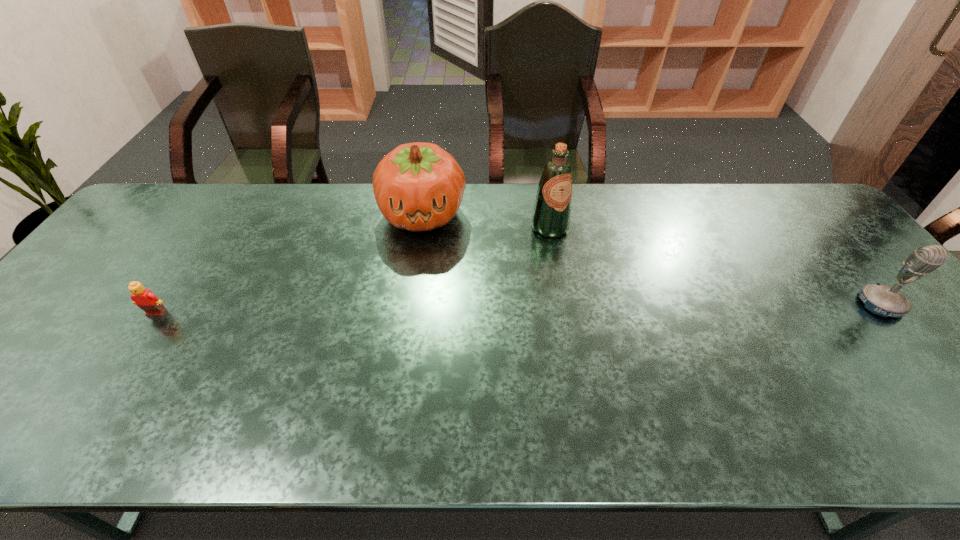
Find the location of a particular element. The height and width of the screenshot is (540, 960). Lego is located at coordinates (143, 298).

You are a GUI agent. You are given a task and a screenshot of the screen. Output one action in this format:
    pyautogui.click(x=<x>, y=<y>)
    Task: Click on the shortest object
    The height and width of the screenshot is (540, 960).
    Given the screenshot: What is the action you would take?
    pyautogui.click(x=143, y=298)

At what (x,y) coordinates should I click in order to perform the action: click on microphone. Please return your answer as a coordinate pair (x, y). The height and width of the screenshot is (540, 960). Looking at the image, I should click on (883, 300).

In order to click on the second shortest object in this screenshot , I will do `click(883, 300)`.

Find the location of a particular element. The width and height of the screenshot is (960, 540). pumpkin is located at coordinates tap(418, 186).

Locate an element on the screen. olive oil is located at coordinates (551, 215).

Image resolution: width=960 pixels, height=540 pixels. In order to click on free region located on the face of the leftmost object in this screenshot , I will do `click(120, 369)`.

Image resolution: width=960 pixels, height=540 pixels. Identify the location of free space located on the front-facing side of the microphone. (924, 358).

Locate an element on the screen. This screenshot has width=960, height=540. free spot located 0.050m on the side of the pumpkin with the cute face is located at coordinates (421, 255).

Image resolution: width=960 pixels, height=540 pixels. I want to click on free region located on the side of the pumpkin with the cute face, so click(420, 288).